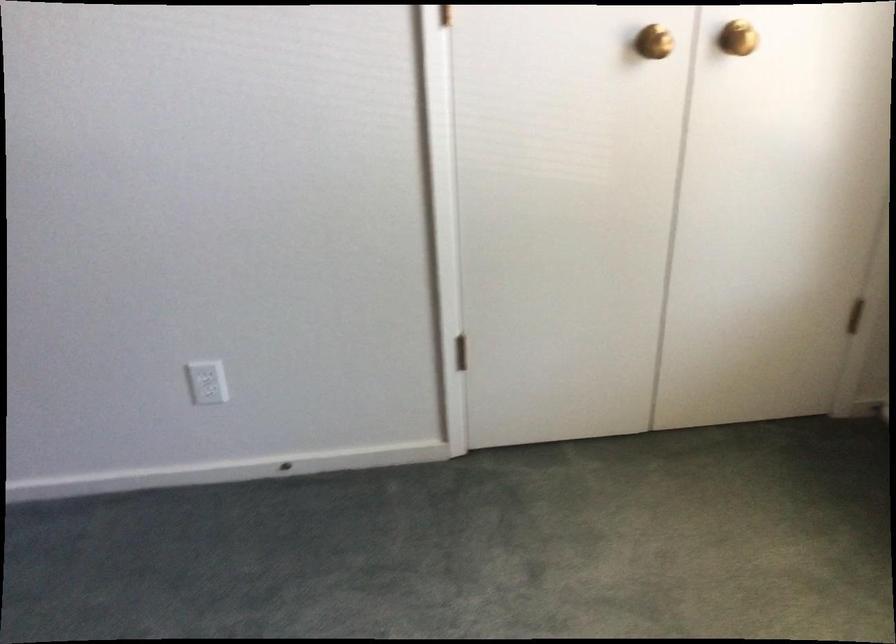
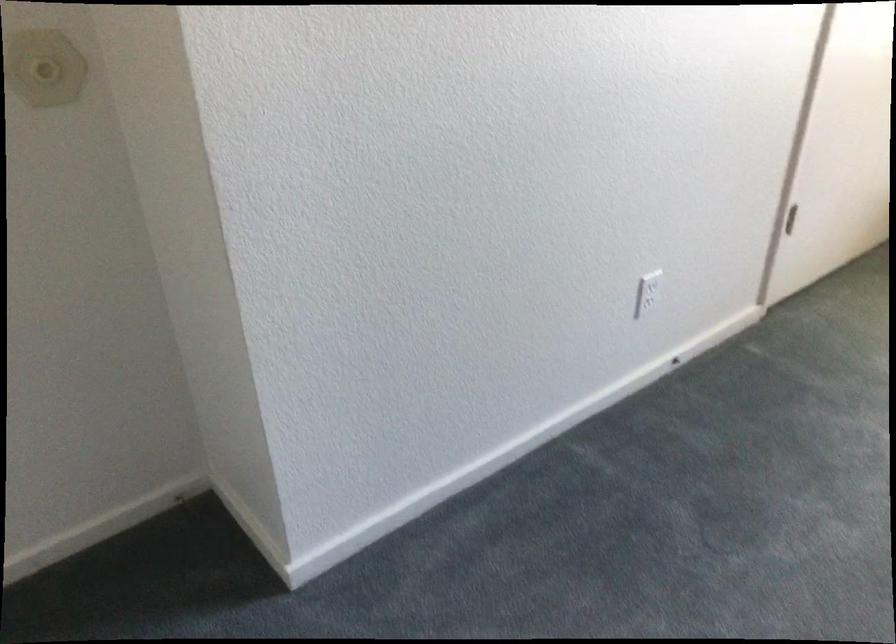
Locate, in the second image, the point that corresponds to (x=478, y=355) in the first image.

(790, 219)